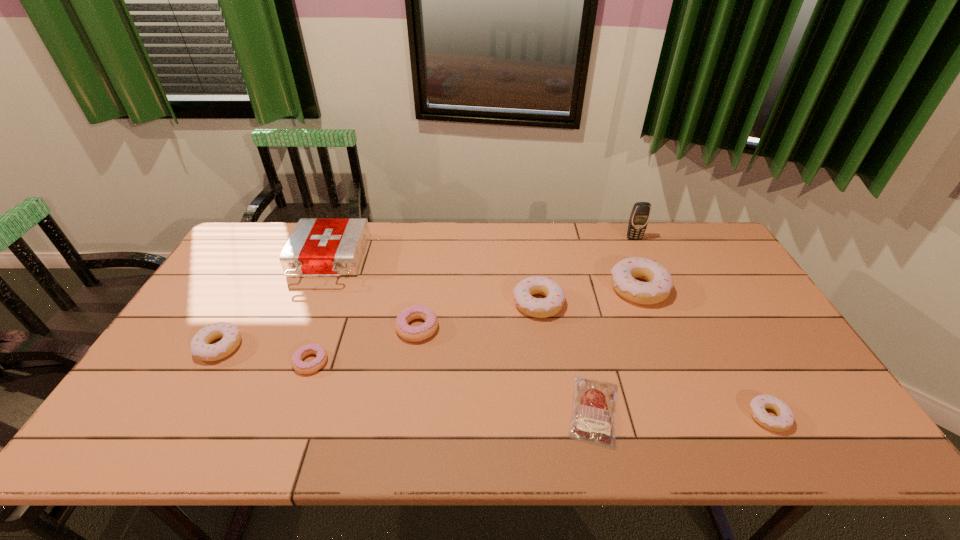
Locate an element on the screen. The image size is (960, 540). blank space that satisfies the following two spatial constraints: 1. on the back side of the farther pink doughnut; 2. on the right side of the seventh shortest object is located at coordinates (423, 288).

You are a GUI agent. You are given a task and a screenshot of the screen. Output one action in this format:
    pyautogui.click(x=<x>, y=<y>)
    Task: Click on the free region that satisfies the following two spatial constraints: 1. on the front face of the tallest object; 2. on the left side of the rightmost white doughnut
    Image resolution: width=960 pixels, height=540 pixels.
    Given the screenshot: What is the action you would take?
    pyautogui.click(x=713, y=416)

Image resolution: width=960 pixels, height=540 pixels. Identify the location of vacant space that satisfies the following two spatial constraints: 1. on the back side of the third white doughnut from right to left; 2. on the right side of the third farthest white doughnut. (244, 303).

This screenshot has height=540, width=960. I want to click on blank space that satisfies the following two spatial constraints: 1. on the back side of the leftmost white doughnut; 2. on the right side of the third doughnut from right to left, so click(x=244, y=303).

The height and width of the screenshot is (540, 960). Identify the location of vacant space that satisfies the following two spatial constraints: 1. on the back side of the third doughnut from right to left; 2. on the right side of the leftmost object. (244, 303).

The width and height of the screenshot is (960, 540). I want to click on vacant region that satisfies the following two spatial constraints: 1. on the front side of the steak; 2. on the left side of the first-aid kit, so click(x=267, y=410).